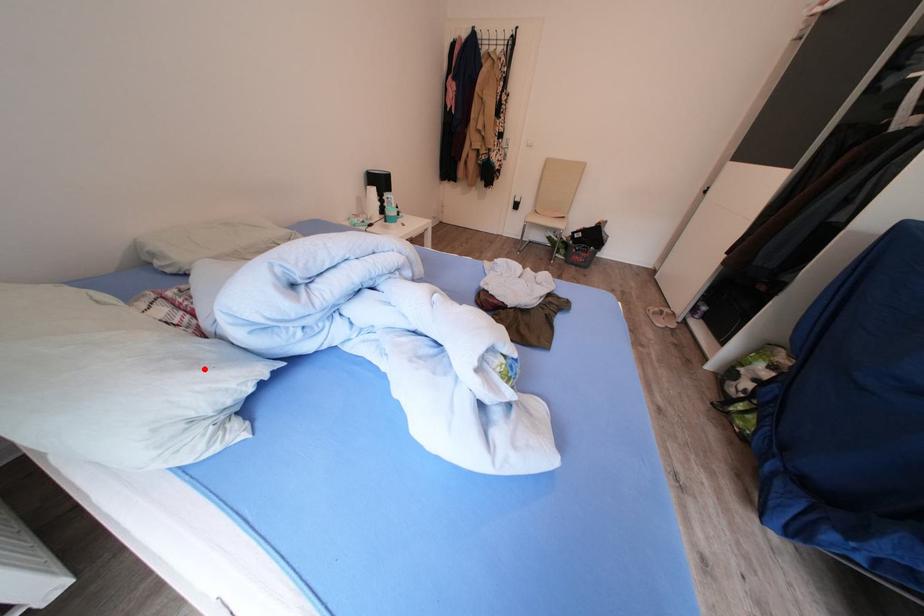
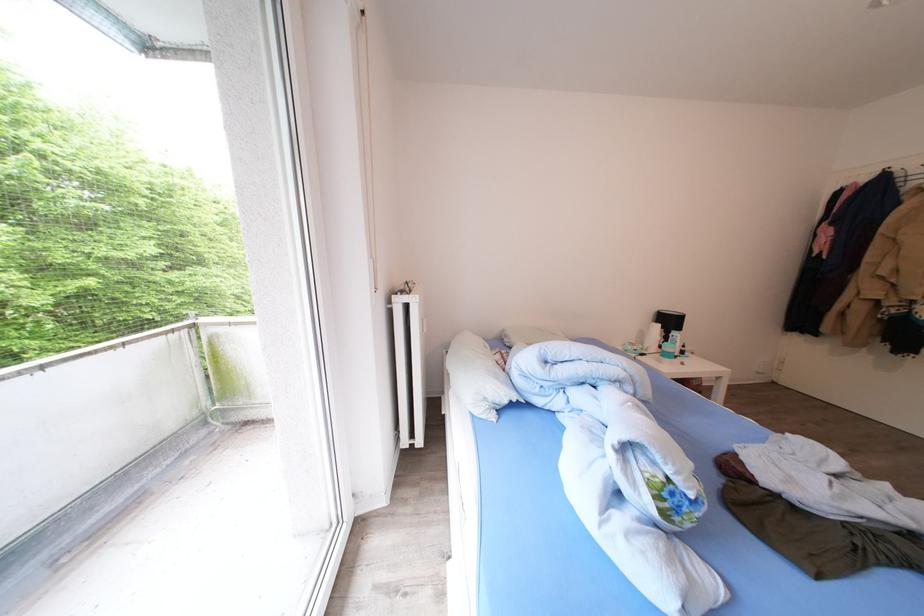
Locate, in the second image, the point that corresponds to the highlighted location in the first image.

(505, 383)